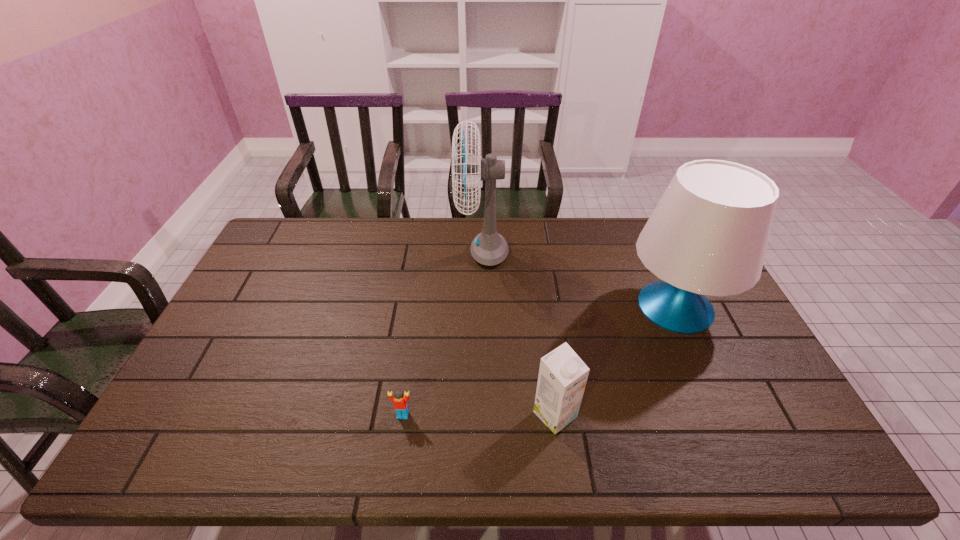
In the image, there is a desktop. Find the location of `vacant space at the right edge`. vacant space at the right edge is located at coordinates (771, 389).

This screenshot has width=960, height=540. In order to click on vacant area at the far left corner of the desktop in this screenshot , I will do `click(265, 251)`.

You are a GUI agent. You are given a task and a screenshot of the screen. Output one action in this format:
    pyautogui.click(x=<x>, y=<y>)
    Task: Click on the empty space between the Lego and the third tallest object
    This screenshot has height=540, width=960.
    Given the screenshot: What is the action you would take?
    pyautogui.click(x=479, y=415)

Identify the location of free area in between the carton and the fan. The height and width of the screenshot is (540, 960). (519, 333).

You are a GUI agent. You are given a task and a screenshot of the screen. Output one action in this format:
    pyautogui.click(x=<x>, y=<y>)
    Task: Click on the free space between the carton and the rightmost object
    This screenshot has width=960, height=540.
    Given the screenshot: What is the action you would take?
    pyautogui.click(x=615, y=361)

Locate an element on the screen. unoccupied position between the second object from left to right and the rightmost object is located at coordinates (579, 279).

Where is `free point between the second shortest object and the table lamp`? This screenshot has height=540, width=960. free point between the second shortest object and the table lamp is located at coordinates (615, 361).

Where is `free space between the leftmost object and the second object from right to left`? The height and width of the screenshot is (540, 960). free space between the leftmost object and the second object from right to left is located at coordinates (479, 415).

Where is `empty location between the third tallest object and the shortest object`? The height and width of the screenshot is (540, 960). empty location between the third tallest object and the shortest object is located at coordinates (479, 415).

The height and width of the screenshot is (540, 960). In order to click on unoccupied position between the third object from left to right and the fan in this screenshot , I will do `click(519, 333)`.